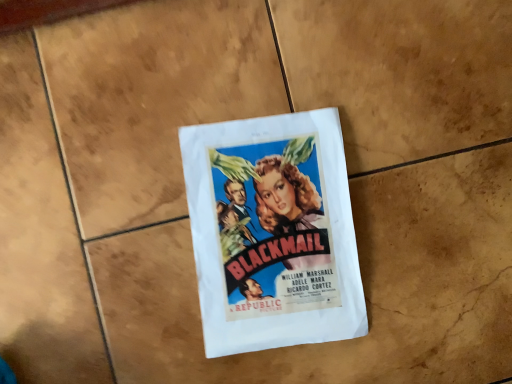
What is the approximate height of matte paper poster at center?

matte paper poster at center is 1.06 inches tall.

Where is `matte paper poster at center`? This screenshot has width=512, height=384. matte paper poster at center is located at coordinates (273, 232).

What do you see at coordinates (273, 232) in the screenshot? This screenshot has width=512, height=384. I see `matte paper poster at center` at bounding box center [273, 232].

Identify the location of matte paper poster at center. (273, 232).